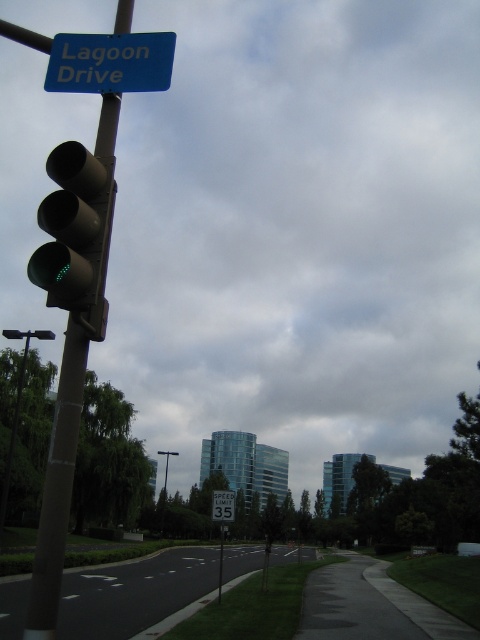
Which is more to the left, green matte traffic light at left or white plastic speed limit sign at center?

green matte traffic light at left

Does green matte traffic light at left have a smaller size compared to white plastic speed limit sign at center?

Actually, green matte traffic light at left might be larger than white plastic speed limit sign at center.

What do you see at coordinates (74, 228) in the screenshot? I see `green matte traffic light at left` at bounding box center [74, 228].

You are a GUI agent. You are given a task and a screenshot of the screen. Output one action in this format:
    pyautogui.click(x=<x>, y=<y>)
    Task: Click on the green matte traffic light at left
    
    Given the screenshot: What is the action you would take?
    pyautogui.click(x=74, y=228)

Between black asphalt road at lower center and metallic pole at left, which one has less height?

With less height is metallic pole at left.

Is point (81, 593) farther from camera compared to point (24, 362)?

No, (81, 593) is in front of (24, 362).

At what (x,y) coordinates should I click in order to perform the action: click on black asphalt road at lower center. Please return your answer as a coordinate pair (x, y). Looking at the image, I should click on (133, 593).

Does green matte traffic light at left have a smaller size compared to metallic pole at left?

Correct, green matte traffic light at left occupies less space than metallic pole at left.

Does green matte traffic light at left have a greater width compared to metallic pole at left?

In fact, green matte traffic light at left might be narrower than metallic pole at left.

Who is more forward, (75,204) or (1,522)?

Positioned in front is point (75,204).

Identify the location of green matte traffic light at left. (74, 228).